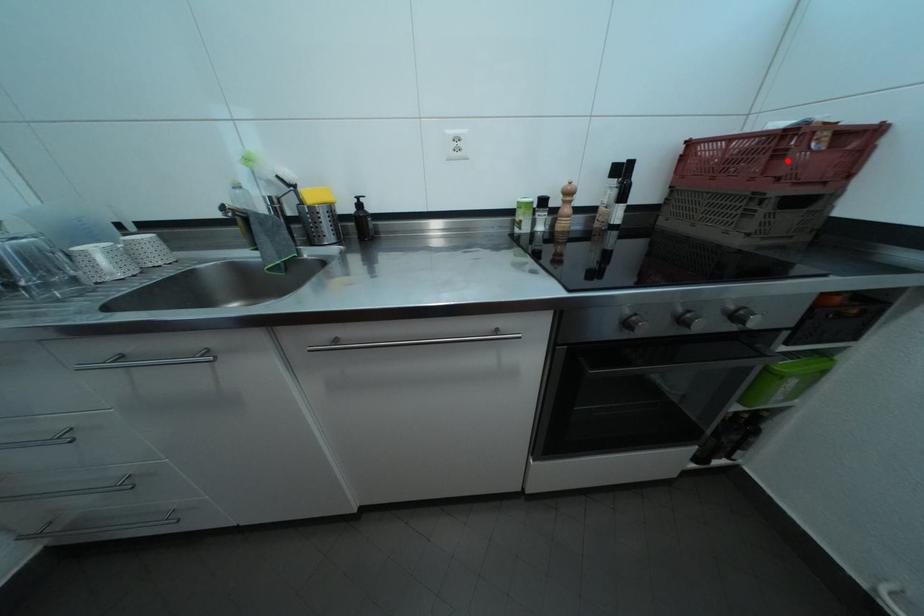
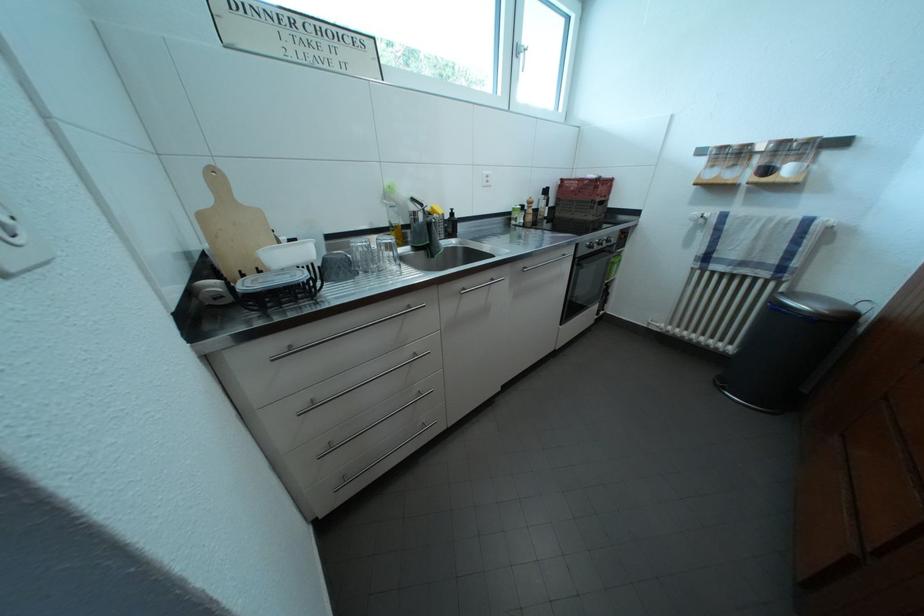
The point at the highlighted location is marked in the first image. Where is the corresponding point in the second image?

(605, 193)